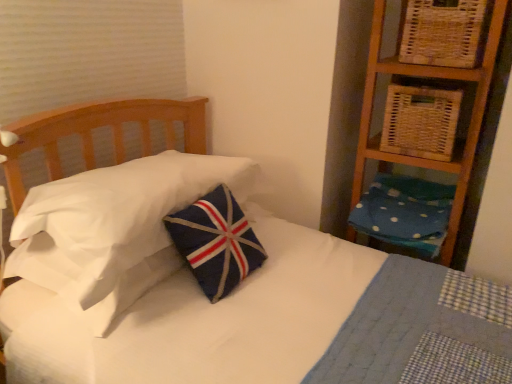
The height and width of the screenshot is (384, 512). I want to click on blue dotted fabric pillow at right, acting as the 2th pillow starting from the left, so click(403, 209).

Describe the element at coordinates (112, 219) in the screenshot. I see `navy felt pillow at center, the first pillow in the left-to-right sequence` at that location.

This screenshot has height=384, width=512. I want to click on woven wicker basket at upper right, marked as the second basket in a bottom-to-top arrangement, so click(443, 32).

This screenshot has height=384, width=512. I want to click on blue dotted fabric pillow at right, acting as the 2th pillow starting from the left, so click(x=403, y=209).

From a real-world perspective, does woven wicker basket at upper right, marked as the second basket in a bottom-to-top arrangement, stand above navy felt pillow at center, which is the second pillow from right to left?

Yes, from a real-world perspective, woven wicker basket at upper right, marked as the second basket in a bottom-to-top arrangement, is on top of navy felt pillow at center, which is the second pillow from right to left.

In the scene shown: From the image's perspective, is woven wicker basket at upper right, marked as the second basket in a bottom-to-top arrangement, located above navy felt pillow at center, which is the second pillow from right to left?

Yes, from the image's perspective, woven wicker basket at upper right, marked as the second basket in a bottom-to-top arrangement, is over navy felt pillow at center, which is the second pillow from right to left.

The height and width of the screenshot is (384, 512). I want to click on the 2nd basket directly above the navy felt pillow at center, the first pillow in the left-to-right sequence (from a real-world perspective), so click(443, 32).

From the picture: Between woven wicker basket at upper right, marked as the second basket in a bottom-to-top arrangement, and navy felt pillow at center, the first pillow in the left-to-right sequence, which one is positioned in front?

navy felt pillow at center, the first pillow in the left-to-right sequence, is more forward.

Which is farther from the camera, (78, 266) or (439, 25)?

Positioned behind is point (439, 25).

Based on their sizes in the image, would you say navy felt pillow at center, the first pillow in the left-to-right sequence, is bigger or smaller than woven wicker basket at upper right, marked as the second basket in a bottom-to-top arrangement?

In the image, navy felt pillow at center, the first pillow in the left-to-right sequence, appears to be larger than woven wicker basket at upper right, marked as the second basket in a bottom-to-top arrangement.

Can you tell me how much navy felt pillow at center, which is the second pillow from right to left, and woven wicker basket at upper right, the first basket viewed from the top, differ in facing direction?

The facing directions of navy felt pillow at center, which is the second pillow from right to left, and woven wicker basket at upper right, the first basket viewed from the top, are 89.7 degrees apart.

Is navy felt pillow at center, the first pillow in the left-to-right sequence, in contact with woven wicker basket at upper right, marked as the second basket in a bottom-to-top arrangement?

navy felt pillow at center, the first pillow in the left-to-right sequence, and woven wicker basket at upper right, marked as the second basket in a bottom-to-top arrangement, are clearly separated.

Is blue dotted fabric pillow at right, the first pillow viewed from the right, thinner than navy felt pillow at center, the first pillow in the left-to-right sequence?

In fact, blue dotted fabric pillow at right, the first pillow viewed from the right, might be wider than navy felt pillow at center, the first pillow in the left-to-right sequence.

From the image's perspective, who appears lower, blue dotted fabric pillow at right, the first pillow viewed from the right, or navy felt pillow at center, the first pillow in the left-to-right sequence?

blue dotted fabric pillow at right, the first pillow viewed from the right.

Is woven natural basket at upper right, which is counted as the first basket, starting from the bottom, facing towards woven wicker basket at upper right, marked as the second basket in a bottom-to-top arrangement?

No, woven natural basket at upper right, which is counted as the first basket, starting from the bottom, is not aimed at woven wicker basket at upper right, marked as the second basket in a bottom-to-top arrangement.

Is point (405, 109) farther from viewer compared to point (411, 2)?

Yes, point (405, 109) is farther from viewer.

Are woven natural basket at upper right, which is counted as the first basket, starting from the bottom, and woven wicker basket at upper right, the first basket viewed from the top, making contact?

No, woven natural basket at upper right, which is counted as the first basket, starting from the bottom, is not in contact with woven wicker basket at upper right, the first basket viewed from the top.

Could you measure the distance between woven natural basket at upper right, the second basket viewed from the top, and woven wicker basket at upper right, marked as the second basket in a bottom-to-top arrangement?

6.96 inches.

Which point is more forward, (443, 4) or (413, 86)?

Point (443, 4)

From a real-world perspective, is woven wicker basket at upper right, the first basket viewed from the top, positioned under woven natural basket at upper right, the second basket viewed from the top, based on gravity?

No, from a real-world perspective, woven wicker basket at upper right, the first basket viewed from the top, is not below woven natural basket at upper right, the second basket viewed from the top.

Looking at their sizes, would you say woven wicker basket at upper right, marked as the second basket in a bottom-to-top arrangement, is wider or thinner than woven natural basket at upper right, the second basket viewed from the top?

Considering their sizes, woven wicker basket at upper right, marked as the second basket in a bottom-to-top arrangement, looks slimmer than woven natural basket at upper right, the second basket viewed from the top.

Is woven wicker basket at upper right, the first basket viewed from the top, to the left or to the right of woven natural basket at upper right, which is counted as the first basket, starting from the bottom, in the image?

woven wicker basket at upper right, the first basket viewed from the top, is positioned on woven natural basket at upper right, which is counted as the first basket, starting from the bottom,'s right side.

Locate an element on the screen. The width and height of the screenshot is (512, 384). the 1st pillow counting from the left of the woven wicker basket at upper right, marked as the second basket in a bottom-to-top arrangement is located at coordinates (403, 209).

Who is more distant, woven wicker basket at upper right, marked as the second basket in a bottom-to-top arrangement, or blue dotted fabric pillow at right, acting as the 2th pillow starting from the left?

blue dotted fabric pillow at right, acting as the 2th pillow starting from the left, is further away from the camera.

Would you say woven wicker basket at upper right, marked as the second basket in a bottom-to-top arrangement, is outside blue dotted fabric pillow at right, acting as the 2th pillow starting from the left?

Yes, woven wicker basket at upper right, marked as the second basket in a bottom-to-top arrangement, is outside of blue dotted fabric pillow at right, acting as the 2th pillow starting from the left.

Considering the relative positions of navy felt pillow at center, the first pillow in the left-to-right sequence, and woven natural basket at upper right, which is counted as the first basket, starting from the bottom, in the image provided, is navy felt pillow at center, the first pillow in the left-to-right sequence, to the right of woven natural basket at upper right, which is counted as the first basket, starting from the bottom, from the viewer's perspective?

No, navy felt pillow at center, the first pillow in the left-to-right sequence, is not to the right of woven natural basket at upper right, which is counted as the first basket, starting from the bottom.

From a real-world perspective, between navy felt pillow at center, the first pillow in the left-to-right sequence, and woven natural basket at upper right, which is counted as the first basket, starting from the bottom, who is vertically higher?

woven natural basket at upper right, which is counted as the first basket, starting from the bottom.

Considering the relative sizes of navy felt pillow at center, which is the second pillow from right to left, and woven natural basket at upper right, which is counted as the first basket, starting from the bottom, in the image provided, is navy felt pillow at center, which is the second pillow from right to left, smaller than woven natural basket at upper right, which is counted as the first basket, starting from the bottom,?

Actually, navy felt pillow at center, which is the second pillow from right to left, might be larger than woven natural basket at upper right, which is counted as the first basket, starting from the bottom.

In the scene shown: How different are the orientations of navy felt pillow at center, the first pillow in the left-to-right sequence, and woven natural basket at upper right, the second basket viewed from the top, in degrees?

The angle between the facing direction of navy felt pillow at center, the first pillow in the left-to-right sequence, and the facing direction of woven natural basket at upper right, the second basket viewed from the top, is 90.7 degrees.

Where is `the 1st basket behind the navy felt pillow at center, the first pillow in the left-to-right sequence, starting your count from the anchor`? Image resolution: width=512 pixels, height=384 pixels. the 1st basket behind the navy felt pillow at center, the first pillow in the left-to-right sequence, starting your count from the anchor is located at coordinates (443, 32).

Where is `the 1st pillow directly beneath the woven wicker basket at upper right, marked as the second basket in a bottom-to-top arrangement (from a real-world perspective)`? the 1st pillow directly beneath the woven wicker basket at upper right, marked as the second basket in a bottom-to-top arrangement (from a real-world perspective) is located at coordinates (112, 219).

When comparing their distances from woven wicker basket at upper right, marked as the second basket in a bottom-to-top arrangement, does woven natural basket at upper right, the second basket viewed from the top, or navy felt pillow at center, the first pillow in the left-to-right sequence, seem closer?

Based on the image, woven natural basket at upper right, the second basket viewed from the top, appears to be nearer to woven wicker basket at upper right, marked as the second basket in a bottom-to-top arrangement.

Considering their positions, is woven wicker basket at upper right, marked as the second basket in a bottom-to-top arrangement, positioned closer to woven natural basket at upper right, the second basket viewed from the top, than blue dotted fabric pillow at right, acting as the 2th pillow starting from the left?

woven wicker basket at upper right, marked as the second basket in a bottom-to-top arrangement, lies closer to woven natural basket at upper right, the second basket viewed from the top, than the other object.

Looking at the image, which one is located closer to woven wicker basket at upper right, the first basket viewed from the top, blue dotted fabric pillow at right, the first pillow viewed from the right, or woven natural basket at upper right, which is counted as the first basket, starting from the bottom?

The object closer to woven wicker basket at upper right, the first basket viewed from the top, is woven natural basket at upper right, which is counted as the first basket, starting from the bottom.

Considering their positions, is woven wicker basket at upper right, the first basket viewed from the top, positioned closer to blue dotted fabric pillow at right, the first pillow viewed from the right, than woven natural basket at upper right, the second basket viewed from the top?

The object closer to blue dotted fabric pillow at right, the first pillow viewed from the right, is woven natural basket at upper right, the second basket viewed from the top.

Based on their spatial positions, is blue dotted fabric pillow at right, acting as the 2th pillow starting from the left, or woven wicker basket at upper right, the first basket viewed from the top, further from navy felt pillow at center, which is the second pillow from right to left?

woven wicker basket at upper right, the first basket viewed from the top, is positioned further to the anchor navy felt pillow at center, which is the second pillow from right to left.

Based on the photo, considering their positions, is navy felt pillow at center, the first pillow in the left-to-right sequence, positioned closer to blue dotted fabric pillow at right, the first pillow viewed from the right, than woven wicker basket at upper right, the first basket viewed from the top?

woven wicker basket at upper right, the first basket viewed from the top, is positioned closer to the anchor blue dotted fabric pillow at right, the first pillow viewed from the right.

When comparing their distances from woven natural basket at upper right, the second basket viewed from the top, does blue dotted fabric pillow at right, the first pillow viewed from the right, or navy felt pillow at center, which is the second pillow from right to left, seem further?

navy felt pillow at center, which is the second pillow from right to left, lies further to woven natural basket at upper right, the second basket viewed from the top, than the other object.

Based on their spatial positions, is navy felt pillow at center, which is the second pillow from right to left, or blue dotted fabric pillow at right, the first pillow viewed from the right, further from woven wicker basket at upper right, the first basket viewed from the top?

navy felt pillow at center, which is the second pillow from right to left, is positioned further to the anchor woven wicker basket at upper right, the first basket viewed from the top.

You are a GUI agent. You are given a task and a screenshot of the screen. Output one action in this format:
    pyautogui.click(x=<x>, y=<y>)
    Task: Click on the basket between navy felt pillow at center, the first pillow in the left-to-right sequence, and blue dotted fabric pillow at right, the first pillow viewed from the right, in the horizontal direction
    
    Given the screenshot: What is the action you would take?
    pyautogui.click(x=421, y=121)

The height and width of the screenshot is (384, 512). I want to click on pillow between navy felt pillow at center, which is the second pillow from right to left, and woven wicker basket at upper right, the first basket viewed from the top, from left to right, so coord(403,209).

You are a GUI agent. You are given a task and a screenshot of the screen. Output one action in this format:
    pyautogui.click(x=<x>, y=<y>)
    Task: Click on the basket situated between navy felt pillow at center, the first pillow in the left-to-right sequence, and woven wicker basket at upper right, marked as the second basket in a bottom-to-top arrangement, from left to right
    
    Given the screenshot: What is the action you would take?
    pyautogui.click(x=421, y=121)

At what (x,y) coordinates should I click in order to perform the action: click on basket between woven wicker basket at upper right, marked as the second basket in a bottom-to-top arrangement, and blue dotted fabric pillow at right, the first pillow viewed from the right, vertically. Please return your answer as a coordinate pair (x, y). The width and height of the screenshot is (512, 384). Looking at the image, I should click on (421, 121).